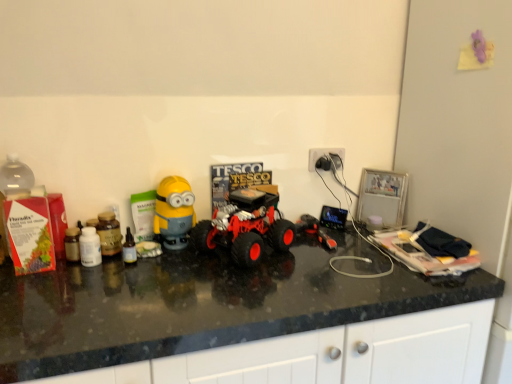
Question: Is rubberized red monster truck at center, which is counted as the second toy, starting from the left, beside rubberized black toy truck at center, placed as the first toy when sorted from right to left?

Choices:
 (A) yes
 (B) no

Answer: (B)

Question: Is rubberized red monster truck at center, the 2th toy viewed from the right, positioned before rubberized black toy truck at center, placed as the first toy when sorted from right to left?

Choices:
 (A) no
 (B) yes

Answer: (B)

Question: From a real-world perspective, is rubberized red monster truck at center, the 2th toy viewed from the right, physically below rubberized black toy truck at center, placed as the first toy when sorted from right to left?

Choices:
 (A) no
 (B) yes

Answer: (A)

Question: Is rubberized red monster truck at center, which is counted as the second toy, starting from the left, outside of rubberized black toy truck at center, placed as the first toy when sorted from right to left?

Choices:
 (A) no
 (B) yes

Answer: (B)

Question: Can you confirm if rubberized red monster truck at center, the 2th toy viewed from the right, is bigger than rubberized black toy truck at center, placed as the first toy when sorted from right to left?

Choices:
 (A) yes
 (B) no

Answer: (A)

Question: Does rubberized red monster truck at center, the 2th toy viewed from the right, have a greater width compared to rubberized black toy truck at center, placed as the first toy when sorted from right to left?

Choices:
 (A) no
 (B) yes

Answer: (B)

Question: From a real-world perspective, is white plastic plug at upper right over rubberized black toy truck at center, placed as the first toy when sorted from right to left?

Choices:
 (A) no
 (B) yes

Answer: (B)

Question: Is white plastic plug at upper right taller than rubberized black toy truck at center, placed as the first toy when sorted from right to left?

Choices:
 (A) yes
 (B) no

Answer: (A)

Question: Is white plastic plug at upper right facing towards rubberized black toy truck at center, placed as the first toy when sorted from right to left?

Choices:
 (A) yes
 (B) no

Answer: (B)

Question: Is white plastic plug at upper right smaller than rubberized black toy truck at center, arranged as the 3th toy when viewed from the left?

Choices:
 (A) yes
 (B) no

Answer: (A)

Question: Is white plastic plug at upper right in contact with rubberized black toy truck at center, placed as the first toy when sorted from right to left?

Choices:
 (A) yes
 (B) no

Answer: (B)

Question: Is rubberized black toy truck at center, arranged as the 3th toy when viewed from the left, at the back of white plastic plug at upper right?

Choices:
 (A) yes
 (B) no

Answer: (B)

Question: Does rubberized red monster truck at center, which is counted as the second toy, starting from the left, turn towards black glossy countertop at center?

Choices:
 (A) no
 (B) yes

Answer: (A)